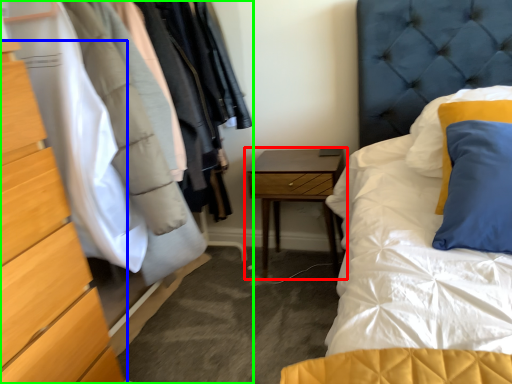
Question: Considering the real-world distances, which object is closest to nightstand (highlighted by a red box)? chest of drawers (highlighted by a blue box) or dresser (highlighted by a green box).

Choices:
 (A) chest of drawers
 (B) dresser

Answer: (B)